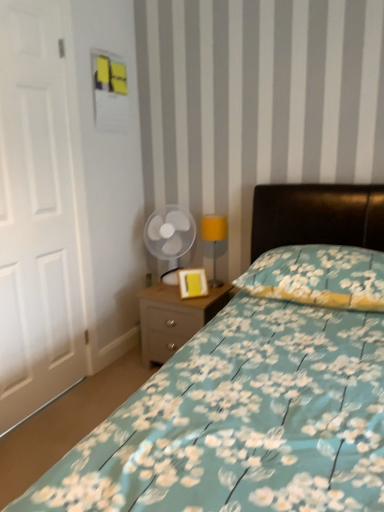
Question: Can we say floral fabric bed at center lies outside yellow matte picture frame at center?

Choices:
 (A) no
 (B) yes

Answer: (B)

Question: From the image's perspective, does floral fabric bed at center appear lower than yellow matte picture frame at center?

Choices:
 (A) yes
 (B) no

Answer: (A)

Question: From a real-world perspective, is floral fabric bed at center located higher than yellow matte picture frame at center?

Choices:
 (A) yes
 (B) no

Answer: (A)

Question: Is floral fabric bed at center shorter than yellow matte picture frame at center?

Choices:
 (A) yes
 (B) no

Answer: (B)

Question: Could you tell me if floral fabric bed at center is facing yellow matte picture frame at center?

Choices:
 (A) yes
 (B) no

Answer: (B)

Question: From the image's perspective, relative to yellow fabric lampshade at center, is transparent plastic fan at center above or below?

Choices:
 (A) below
 (B) above

Answer: (B)

Question: Considering the positions of transparent plastic fan at center and yellow fabric lampshade at center in the image, is transparent plastic fan at center wider or thinner than yellow fabric lampshade at center?

Choices:
 (A) thin
 (B) wide

Answer: (B)

Question: Is point (192, 228) closer or farther from the camera than point (215, 217)?

Choices:
 (A) farther
 (B) closer

Answer: (A)

Question: Considering the positions of transparent plastic fan at center and yellow fabric lampshade at center in the image, is transparent plastic fan at center taller or shorter than yellow fabric lampshade at center?

Choices:
 (A) tall
 (B) short

Answer: (A)

Question: Which is correct: light wood/texture nightstand at lower center is inside white matte door at left, or outside of it?

Choices:
 (A) outside
 (B) inside

Answer: (A)

Question: Is light wood/texture nightstand at lower center bigger or smaller than white matte door at left?

Choices:
 (A) small
 (B) big

Answer: (B)

Question: Looking at their shapes, would you say light wood/texture nightstand at lower center is wider or thinner than white matte door at left?

Choices:
 (A) wide
 (B) thin

Answer: (A)

Question: In terms of height, does light wood/texture nightstand at lower center look taller or shorter compared to white matte door at left?

Choices:
 (A) short
 (B) tall

Answer: (A)

Question: From a real-world perspective, relative to floral fabric pillow at center, is floral fabric bed at center vertically above or below?

Choices:
 (A) below
 (B) above

Answer: (B)

Question: Is point (69, 430) closer or farther from the camera than point (337, 287)?

Choices:
 (A) farther
 (B) closer

Answer: (A)